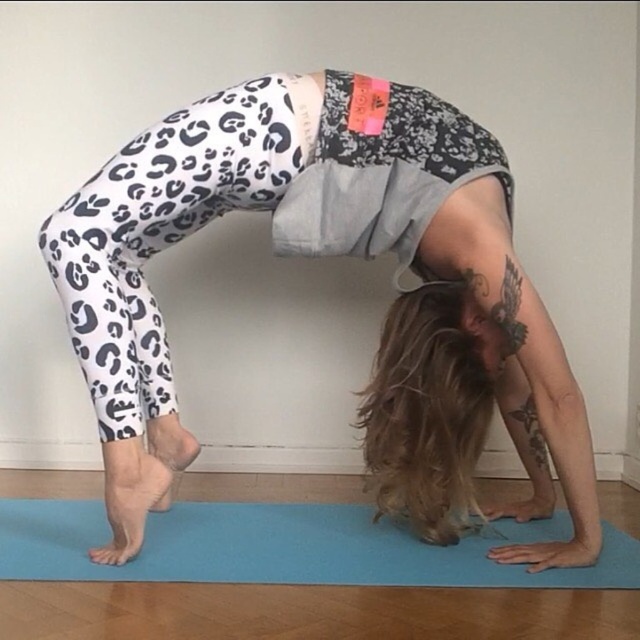
Who is positioned more to the right, white leopard print leggings at center or blue rubber mat at lower center?

From the viewer's perspective, white leopard print leggings at center appears more on the right side.

Who is lower down, white leopard print leggings at center or blue rubber mat at lower center?

Positioned lower is blue rubber mat at lower center.

The image size is (640, 640). What do you see at coordinates (333, 253) in the screenshot?
I see `white leopard print leggings at center` at bounding box center [333, 253].

I want to click on white leopard print leggings at center, so click(x=333, y=253).